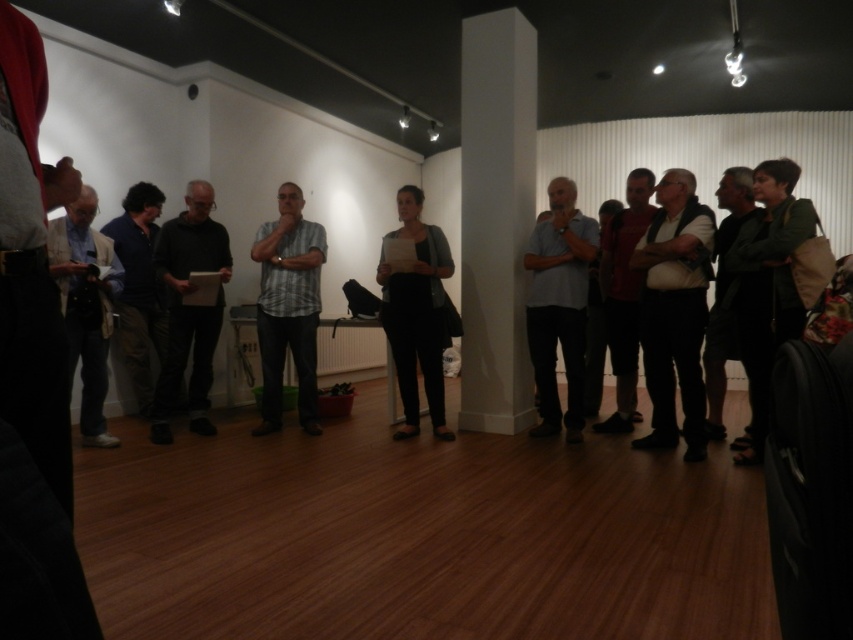
Question: Can you confirm if matte black pants at center is bigger than dark red shirt at center?

Choices:
 (A) no
 (B) yes

Answer: (A)

Question: Which of these objects is positioned closest to the gray cotton shirt at center?

Choices:
 (A) white textured vest at center
 (B) dark gray fabric jacket at left
 (C) matte black pants at center

Answer: (A)

Question: Which object is positioned closest to the matte black pants at center?

Choices:
 (A) white textured vest at center
 (B) gray cotton shirt at center

Answer: (B)

Question: Is white textured vest at center to the left of striped cotton shirt at center from the viewer's perspective?

Choices:
 (A) no
 (B) yes

Answer: (A)

Question: Does black matte shirt at center come behind dark red shirt at center?

Choices:
 (A) yes
 (B) no

Answer: (A)

Question: Based on their relative distances, which object is farther from the black matte shirt at center?

Choices:
 (A) dark blue shirt at left
 (B) dark gray fabric jacket at left
 (C) white textured vest at center
 (D) gray cotton shirt at center

Answer: (C)